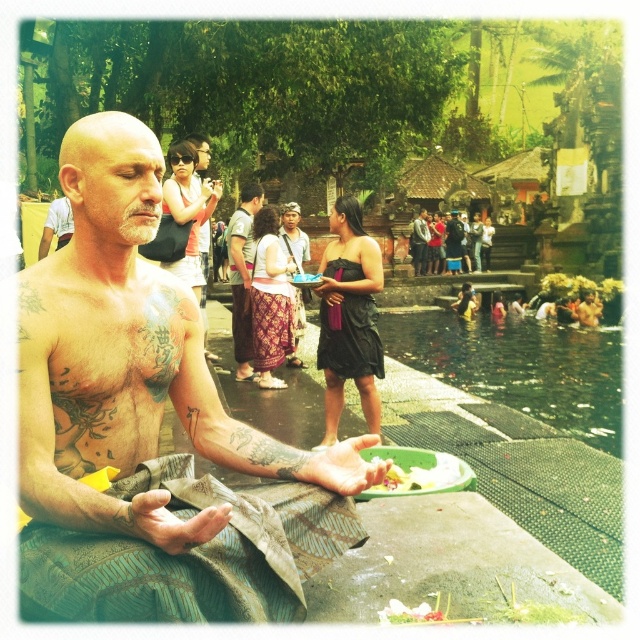
What do you see at coordinates (148, 428) in the screenshot?
I see `shiny metallic cloth at center` at bounding box center [148, 428].

Locate an element on the screen. The width and height of the screenshot is (640, 640). shiny metallic cloth at center is located at coordinates (148, 428).

Is shiny metallic cloth at center wider than dark brown leather sandals at center?

Indeed, shiny metallic cloth at center has a greater width compared to dark brown leather sandals at center.

This screenshot has height=640, width=640. Identify the location of shiny metallic cloth at center. (148, 428).

What do you see at coordinates (148, 428) in the screenshot? I see `shiny metallic cloth at center` at bounding box center [148, 428].

The image size is (640, 640). I want to click on shiny metallic cloth at center, so click(x=148, y=428).

Between shiny metallic cloth at center and dark brown leather bag at center, which one is positioned lower?

shiny metallic cloth at center is below.

Between point (80, 394) and point (451, 253), which one is positioned in front?

Positioned in front is point (80, 394).

The width and height of the screenshot is (640, 640). Find the location of `shiny metallic cloth at center`. shiny metallic cloth at center is located at coordinates (148, 428).